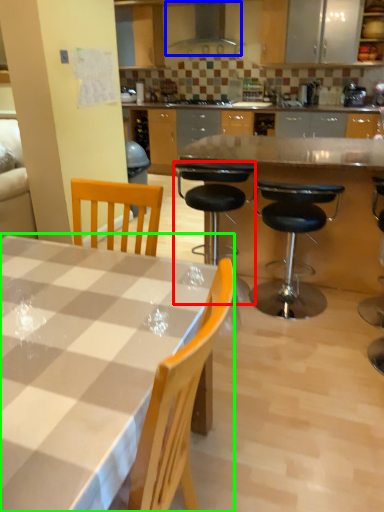
Question: Based on their relative distances, which object is nearer to chair (highlighted by a red box)? Choose from exhaust hood (highlighted by a blue box) and kitchen & dining room table (highlighted by a green box).

Choices:
 (A) exhaust hood
 (B) kitchen & dining room table

Answer: (B)